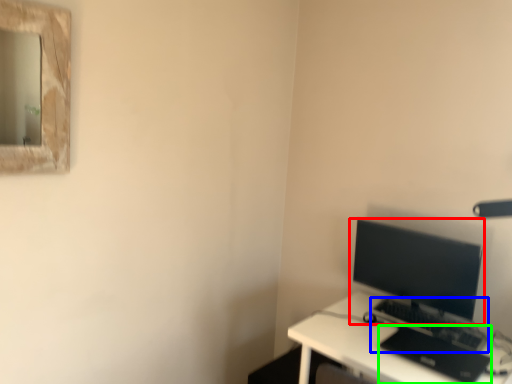
Question: Based on their relative distances, which object is farther from computer monitor (highlighted by a red box)? Choose from computer keyboard (highlighted by a blue box) and laptop (highlighted by a green box).

Choices:
 (A) computer keyboard
 (B) laptop

Answer: (B)